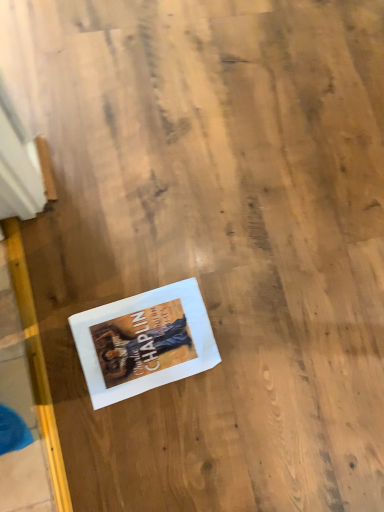
The height and width of the screenshot is (512, 384). What do you see at coordinates (144, 342) in the screenshot? I see `white paper book at center` at bounding box center [144, 342].

Locate an element on the screen. white paper book at center is located at coordinates (144, 342).

In order to face white paper book at center, should I rotate leftwards or rightwards?

Rotate your view left by about 5.917°.

You are a GUI agent. You are given a task and a screenshot of the screen. Output one action in this format:
    pyautogui.click(x=<x>, y=<y>)
    Task: Click on the white paper book at center
    The image size is (384, 512).
    Given the screenshot: What is the action you would take?
    pyautogui.click(x=144, y=342)